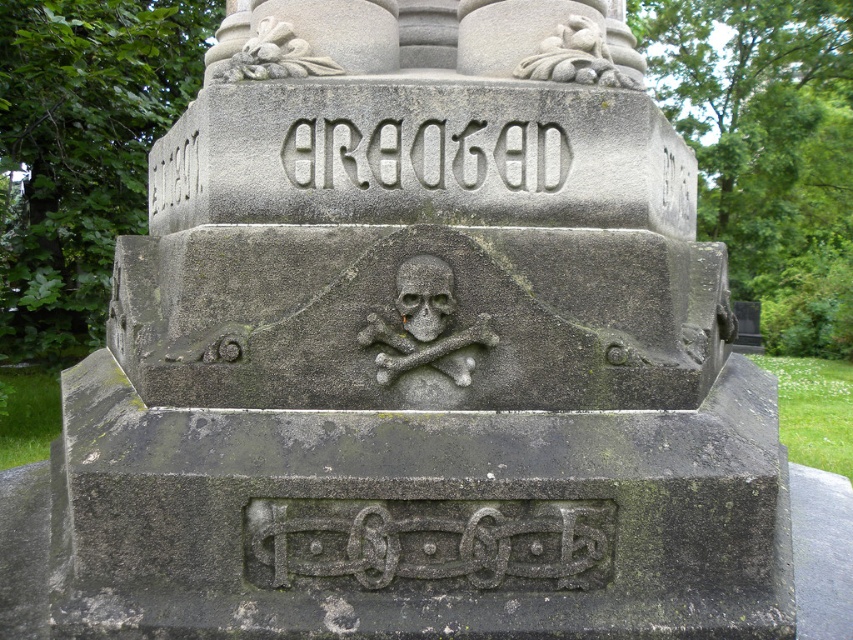
You are standing in front of a weathered stone monument in a cemetery. You notice a specific point marked at coordinates point (413, 342). Can you estimate how far this point is from your current position?

The distance between point (413, 342) and the viewer is 2.86 meters.

You are standing in front of the monument and want to locate the exact point at coordinates point (425, 154). According to the scene description, where would this point be located?

The point (425, 154) is on white stone lettering at center.